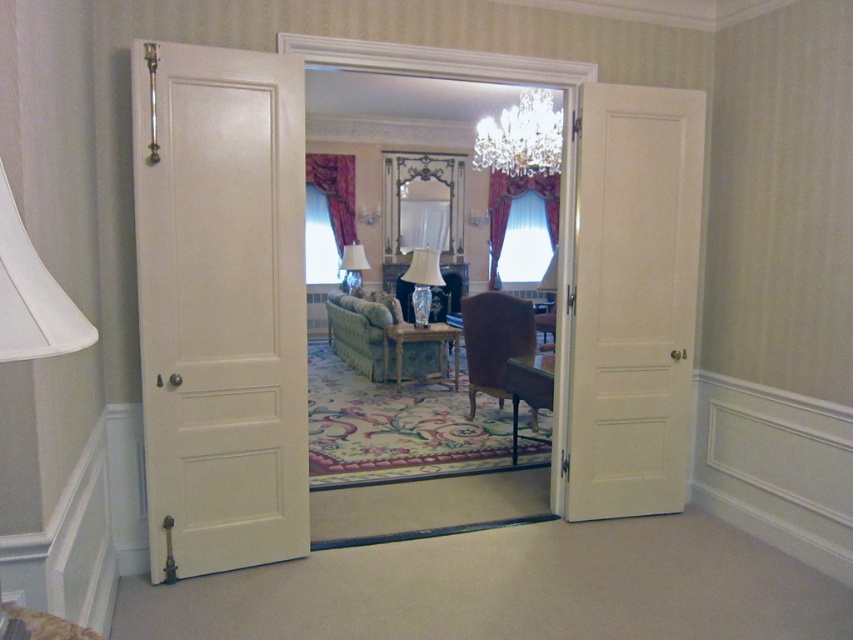
You are moving a large piece of furniture into the room and need to know if it can fit through the doorway. The furniture is as wide as the green fabric armchair at center. Can it pass through the white wood door at left?

The white wood door at left is thinner than the green fabric armchair at center. Since the furniture is as wide as the armchair, it may not fit through the door if the door frame is narrower than the furniture. However, the description only mentions the door being thinner, which refers to its width, but the passage depends on the door frame width. Without specific measurements, it is uncertain. However, since the door is thinner than the armchair, the furniture might be too wide to fit through the door.

You are moving a large piece of furniture into the room and need to ensure it can fit through the doorway. The furniture is the same size as the green fabric armchair at center. Will it fit through the white wood door at left?

The white wood door at left occupies less space than the green fabric armchair at center, so the furniture will not fit through the door.

You are moving a 36 inch wide painting and want to place it between the brown velvet armchair at center and the clear glass vase at center. Can the painting fit in the space between them?

The brown velvet armchair at center and clear glass vase at center are 35.88 inches apart from each other. Since the painting is 36 inches wide, it cannot fit in the space between them because the distance is slightly less than the painting width.